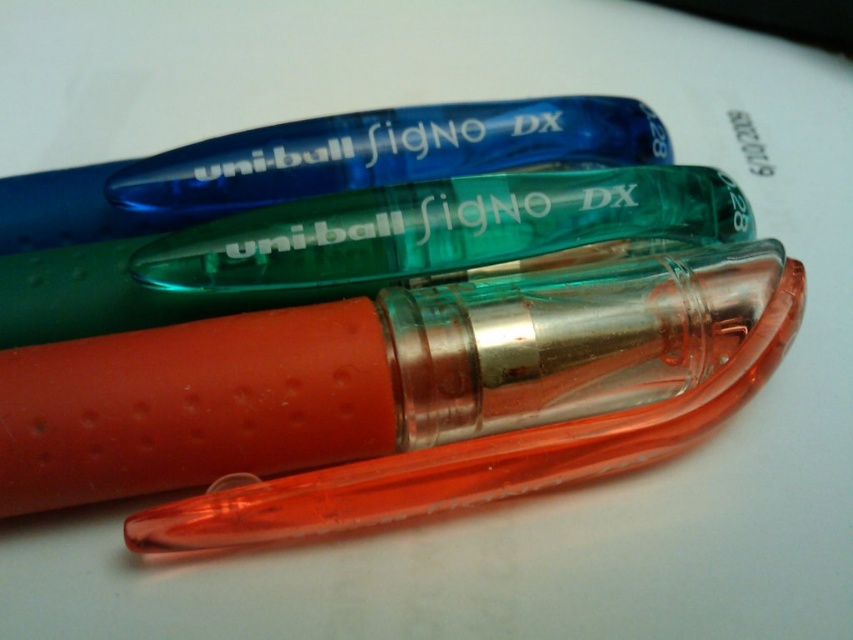
Does translucent orange pen at center appear under translucent green pen at center?

Indeed, translucent orange pen at center is positioned under translucent green pen at center.

This screenshot has height=640, width=853. Describe the element at coordinates (403, 378) in the screenshot. I see `translucent orange pen at center` at that location.

Is point (541, 436) closer to viewer compared to point (196, 236)?

Yes, it is.

You are a GUI agent. You are given a task and a screenshot of the screen. Output one action in this format:
    pyautogui.click(x=<x>, y=<y>)
    Task: Click on the translucent orange pen at center
    This screenshot has height=640, width=853.
    Given the screenshot: What is the action you would take?
    pyautogui.click(x=403, y=378)